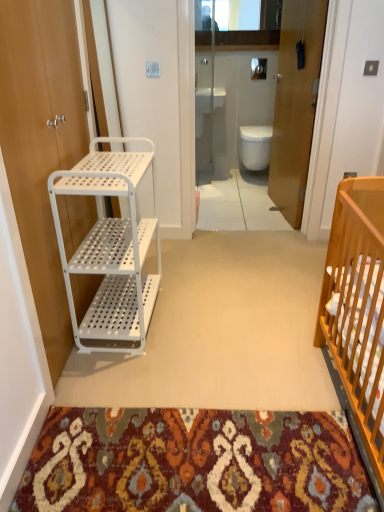
I want to click on vacant area that is in front of white matte door at left, the 2th door from the right, so click(x=132, y=422).